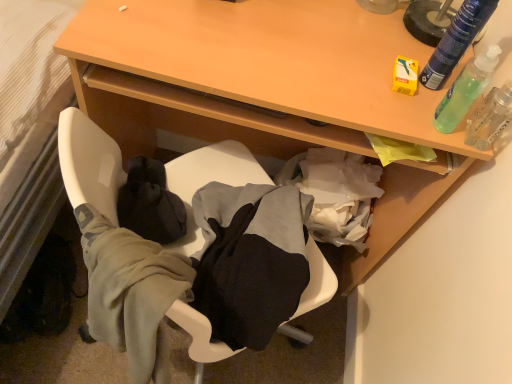
Identify the location of vacant space behind green translucent bottle at upper right, which appears as the 2th bottle when ordered from the bottom. (404, 32).